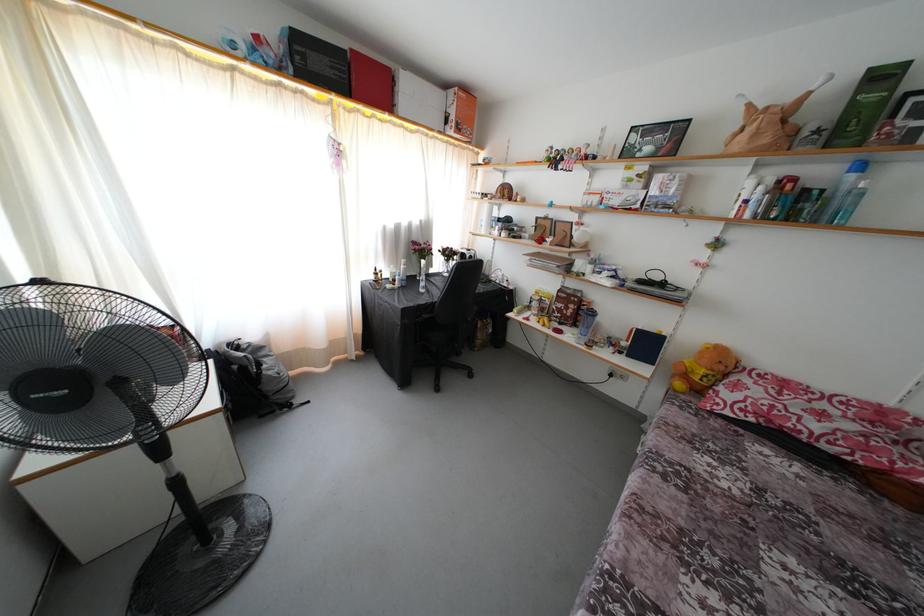
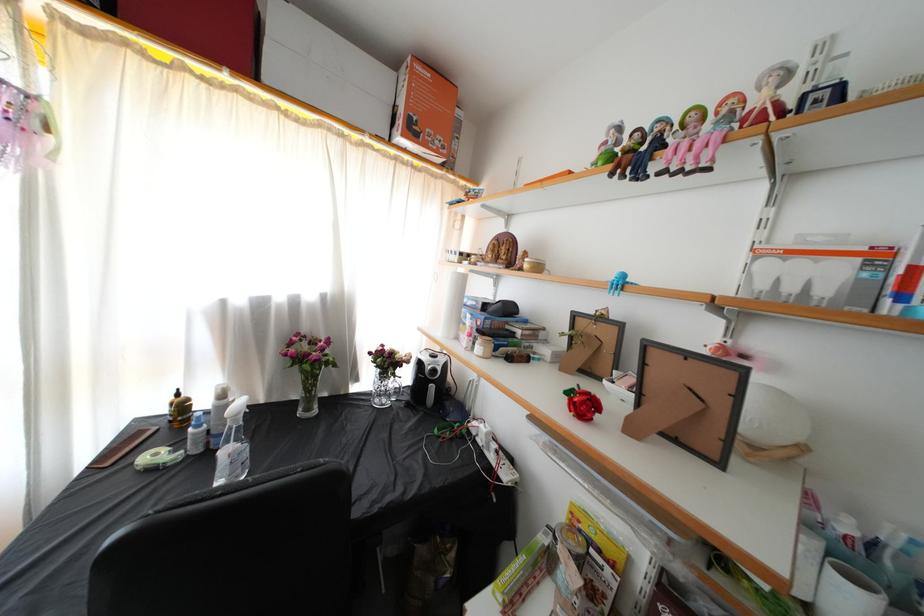
The point at (419, 245) is marked in the first image. Where is the corresponding point in the second image?

(310, 334)